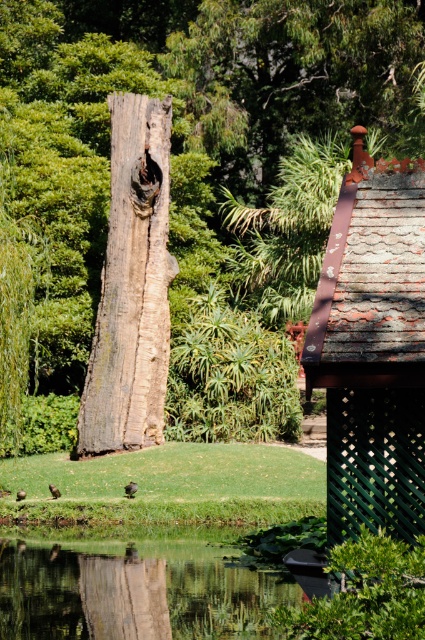
Is weathered wood log at center thinner than weathered wood tree trunk at center?

In fact, weathered wood log at center might be wider than weathered wood tree trunk at center.

Does weathered wood log at center have a larger size compared to weathered wood tree trunk at center?

Indeed, weathered wood log at center has a larger size compared to weathered wood tree trunk at center.

Who is more forward, (238,84) or (161,401)?

Point (161,401)

Where is `weathered wood log at center`? The width and height of the screenshot is (425, 640). weathered wood log at center is located at coordinates tap(172, 136).

Does rusty metal roof at upper right have a greater width compared to weathered wood tree trunk at center?

No, rusty metal roof at upper right is not wider than weathered wood tree trunk at center.

Does rusty metal roof at upper right have a larger size compared to weathered wood tree trunk at center?

Actually, rusty metal roof at upper right might be smaller than weathered wood tree trunk at center.

Who is more distant from viewer, [326,525] or [169,195]?

Positioned behind is point [169,195].

The image size is (425, 640). I want to click on rusty metal roof at upper right, so click(x=373, y=348).

Is point (371, 124) more distant than point (348, 374)?

Yes.

Is weathered wood log at center wider than rusty metal roof at upper right?

Yes, weathered wood log at center is wider than rusty metal roof at upper right.

The image size is (425, 640). What do you see at coordinates (172, 136) in the screenshot?
I see `weathered wood log at center` at bounding box center [172, 136].

Where is `weathered wood log at center`? The height and width of the screenshot is (640, 425). weathered wood log at center is located at coordinates (172, 136).